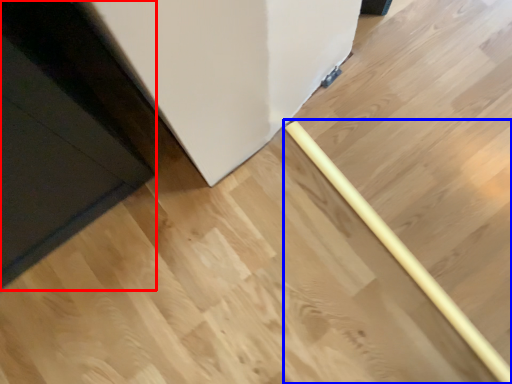
Question: Which point is closer to the camera, door (highlighted by a red box) or rolling pin (highlighted by a blue box)?

Choices:
 (A) door
 (B) rolling pin

Answer: (A)